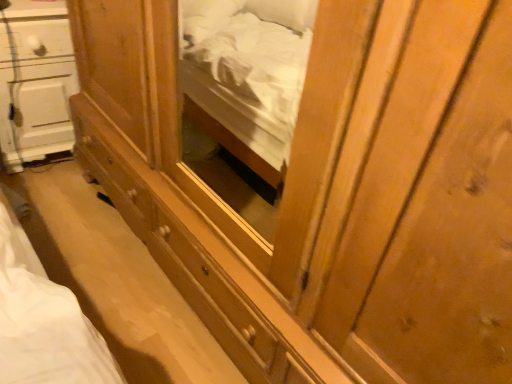
Locate an element on the screen. The image size is (512, 384). white glossy chest of drawers at left is located at coordinates (35, 81).

This screenshot has height=384, width=512. Describe the element at coordinates (35, 81) in the screenshot. I see `white glossy chest of drawers at left` at that location.

Identify the location of white glossy chest of drawers at left. The height and width of the screenshot is (384, 512). (35, 81).